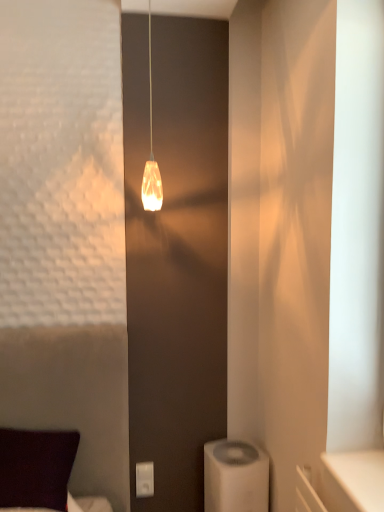
Question: From the image's perspective, relative to white plastic air purifier at lower right, is dark purple fabric pillow at lower left above or below?

Choices:
 (A) below
 (B) above

Answer: (B)

Question: In terms of height, does dark purple fabric pillow at lower left look taller or shorter compared to white plastic air purifier at lower right?

Choices:
 (A) tall
 (B) short

Answer: (B)

Question: Which object is the closest to the translucent glass pendant light at center?

Choices:
 (A) white plastic/light switch at lower center
 (B) dark purple fabric pillow at lower left
 (C) white plastic air purifier at lower right

Answer: (B)

Question: Which is farther from the white plastic/light switch at lower center?

Choices:
 (A) dark purple fabric pillow at lower left
 (B) white plastic air purifier at lower right
 (C) translucent glass pendant light at center

Answer: (C)